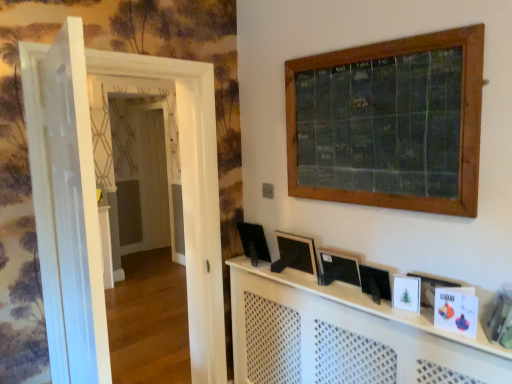
This screenshot has height=384, width=512. What do you see at coordinates (375, 280) in the screenshot? I see `black matte picture frame at center, the second picture frame positioned from the front` at bounding box center [375, 280].

What do you see at coordinates (295, 253) in the screenshot?
I see `black matte picture frame at center, acting as the first picture frame starting from the back` at bounding box center [295, 253].

Find the location of `white glossy door at left, which is counted as the 1th door, starting from the back`. white glossy door at left, which is counted as the 1th door, starting from the back is located at coordinates (96, 205).

The height and width of the screenshot is (384, 512). What do you see at coordinates (406, 293) in the screenshot?
I see `white matte picture frame at lower right, the 3th picture frame viewed from the back` at bounding box center [406, 293].

What do you see at coordinates (389, 123) in the screenshot?
I see `green slate window at upper center` at bounding box center [389, 123].

Where is `black plastic computer screen at center`? The height and width of the screenshot is (384, 512). black plastic computer screen at center is located at coordinates (254, 239).

Find the location of a particular element. Image resolution: width=512 pixels, height=384 pixels. white perforated wood at center is located at coordinates coord(344,336).

Does green slate window at upper center come in front of white perforated wood at center?

No, it is behind white perforated wood at center.

Which of these two, green slate window at upper center or white perforated wood at center, is smaller?

green slate window at upper center.

Is green slate window at upper center facing towards white perforated wood at center?

No.

In the scene shown: Can you confirm if black matte picture frame at center, the second picture frame in the back-to-front sequence, is positioned to the left of white glossy door at left, the second door when ordered from back to front?

No.

From the image's perspective, does black matte picture frame at center, the second picture frame in the back-to-front sequence, appear higher than white glossy door at left, the second door when ordered from back to front?

Incorrect, from the image's perspective, black matte picture frame at center, the second picture frame in the back-to-front sequence, is lower than white glossy door at left, the second door when ordered from back to front.

Is point (361, 283) in front of point (38, 71)?

No, (361, 283) is further to viewer.

Could you tell me if black matte picture frame at center, the second picture frame positioned from the front, is turned towards white glossy door at left, placed as the first door when sorted from front to back?

No, black matte picture frame at center, the second picture frame positioned from the front, does not turn towards white glossy door at left, placed as the first door when sorted from front to back.

In terms of height, does black plastic computer screen at center look taller or shorter compared to white glossy door at left, the second door when ordered from back to front?

In the image, black plastic computer screen at center appears to be shorter than white glossy door at left, the second door when ordered from back to front.

Is the position of black plastic computer screen at center less distant than that of white glossy door at left, placed as the first door when sorted from front to back?

That is False.

From a real-world perspective, is black plastic computer screen at center positioned above or below white glossy door at left, the second door when ordered from back to front?

From a real-world perspective, black plastic computer screen at center is physically below white glossy door at left, the second door when ordered from back to front.

Does black plastic computer screen at center turn towards white glossy door at left, the second door when ordered from back to front?

Yes.

In terms of size, does black matte picture frame at center, acting as the first picture frame starting from the back, appear bigger or smaller than white glossy door at left, the second door when ordered from back to front?

Considering their sizes, black matte picture frame at center, acting as the first picture frame starting from the back, takes up less space than white glossy door at left, the second door when ordered from back to front.

Could you tell me if black matte picture frame at center, marked as the third picture frame in a front-to-back arrangement, is facing white glossy door at left, placed as the first door when sorted from front to back?

Yes, black matte picture frame at center, marked as the third picture frame in a front-to-back arrangement, is oriented towards white glossy door at left, placed as the first door when sorted from front to back.

From the image's perspective, between black matte picture frame at center, marked as the 3th picture frame in a right-to-left arrangement, and white glossy door at left, placed as the first door when sorted from front to back, which one is located above?

From the image's view, white glossy door at left, placed as the first door when sorted from front to back, is above.

Is the surface of black matte picture frame at center, acting as the first picture frame starting from the back, in direct contact with white glossy door at left, placed as the first door when sorted from front to back?

No, black matte picture frame at center, acting as the first picture frame starting from the back, is not with white glossy door at left, placed as the first door when sorted from front to back.

Does point (417, 288) come in front of point (380, 280)?

Yes, point (417, 288) is closer to viewer.

Which object is closer to the camera, white matte picture frame at lower right, which ranks as the 1th picture frame in right-to-left order, or black matte picture frame at center, which is the second picture frame from right to left?

white matte picture frame at lower right, which ranks as the 1th picture frame in right-to-left order, is more forward.

From the image's perspective, which one is positioned lower, white matte picture frame at lower right, the 3th picture frame viewed from the back, or black matte picture frame at center, the second picture frame from the left?

white matte picture frame at lower right, the 3th picture frame viewed from the back, from the image's perspective.

Between white glossy door at left, the second door when ordered from back to front, and white matte picture frame at lower right, which ranks as the 1th picture frame in right-to-left order, which one appears on the right side from the viewer's perspective?

From the viewer's perspective, white matte picture frame at lower right, which ranks as the 1th picture frame in right-to-left order, appears more on the right side.

Considering the relative positions of white glossy door at left, placed as the first door when sorted from front to back, and white matte picture frame at lower right, placed as the 1th picture frame when sorted from front to back, in the image provided, is white glossy door at left, placed as the first door when sorted from front to back, in front of white matte picture frame at lower right, placed as the 1th picture frame when sorted from front to back,?

Yes, it is.

Considering the relative sizes of white glossy door at left, placed as the first door when sorted from front to back, and white matte picture frame at lower right, which ranks as the 1th picture frame in right-to-left order, in the image provided, is white glossy door at left, placed as the first door when sorted from front to back, taller than white matte picture frame at lower right, which ranks as the 1th picture frame in right-to-left order,?

Yes.

Does white glossy door at left, the second door when ordered from back to front, touch white matte picture frame at lower right, the 3th picture frame viewed from the back?

white glossy door at left, the second door when ordered from back to front, and white matte picture frame at lower right, the 3th picture frame viewed from the back, are clearly separated.

Is point (202, 285) farther from camera compared to point (281, 333)?

Yes.

Where is `computer desk located below the white glossy door at left, positioned as the 2th door in front-to-back order (from the image's perspective)`? Image resolution: width=512 pixels, height=384 pixels. computer desk located below the white glossy door at left, positioned as the 2th door in front-to-back order (from the image's perspective) is located at coordinates (344, 336).

From the image's perspective, relative to white perforated wood at center, is white glossy door at left, which is counted as the 1th door, starting from the back, above or below?

Based on their image positions, white glossy door at left, which is counted as the 1th door, starting from the back, is located above white perforated wood at center.

Considering their positions, is white glossy door at left, positioned as the 2th door in front-to-back order, located in front of or behind white perforated wood at center?

Visually, white glossy door at left, positioned as the 2th door in front-to-back order, is located behind white perforated wood at center.

Locate an element on the screen. computer desk in front of the green slate window at upper center is located at coordinates (344, 336).

I want to click on door that is the 2nd object to the left of the black matte picture frame at center, the second picture frame from the left, starting at the anchor, so click(66, 206).

Estimate the real-world distances between objects in this image. Which object is further from white perforated wood at center, white glossy door at left, placed as the first door when sorted from front to back, or white glossy door at left, positioned as the 2th door in front-to-back order?

The object further to white perforated wood at center is white glossy door at left, placed as the first door when sorted from front to back.

Looking at the image, which one is located further to white glossy door at left, positioned as the 2th door in front-to-back order, black plastic computer screen at center or white perforated wood at center?

white perforated wood at center is further to white glossy door at left, positioned as the 2th door in front-to-back order.

From the image, which object appears to be farther from white glossy door at left, placed as the first door when sorted from front to back, black matte picture frame at center, the second picture frame from the left, or green slate window at upper center?

black matte picture frame at center, the second picture frame from the left, is positioned further to the anchor white glossy door at left, placed as the first door when sorted from front to back.

From the image, which object appears to be farther from white glossy door at left, which is counted as the 1th door, starting from the back, white matte picture frame at lower right, the 3th picture frame viewed from the back, or green slate window at upper center?

The object further to white glossy door at left, which is counted as the 1th door, starting from the back, is white matte picture frame at lower right, the 3th picture frame viewed from the back.

Looking at the image, which one is located further to white glossy door at left, placed as the first door when sorted from front to back, white glossy door at left, positioned as the 2th door in front-to-back order, or green slate window at upper center?

Among the two, green slate window at upper center is located further to white glossy door at left, placed as the first door when sorted from front to back.

Based on their spatial positions, is white perforated wood at center or green slate window at upper center closer to black matte picture frame at center, marked as the 3th picture frame in a right-to-left arrangement?

The object closer to black matte picture frame at center, marked as the 3th picture frame in a right-to-left arrangement, is white perforated wood at center.

Estimate the real-world distances between objects in this image. Which object is closer to white glossy door at left, the second door when ordered from back to front, green slate window at upper center or white matte picture frame at lower right, the 3th picture frame in the left-to-right sequence?

green slate window at upper center is closer to white glossy door at left, the second door when ordered from back to front.

Estimate the real-world distances between objects in this image. Which object is further from white matte picture frame at lower right, placed as the 1th picture frame when sorted from front to back, black plastic computer screen at center or white glossy door at left, which is counted as the 1th door, starting from the back?

Based on the image, white glossy door at left, which is counted as the 1th door, starting from the back, appears to be further to white matte picture frame at lower right, placed as the 1th picture frame when sorted from front to back.

Find the location of a particular element. This screenshot has height=384, width=512. window situated between white glossy door at left, which is counted as the 1th door, starting from the back, and white matte picture frame at lower right, the 3th picture frame in the left-to-right sequence, from left to right is located at coordinates (389, 123).

Locate an element on the screen. computer screen located between white glossy door at left, positioned as the 2th door in front-to-back order, and green slate window at upper center in the left-right direction is located at coordinates (254, 239).

Find the location of a particular element. This screenshot has height=384, width=512. picture frame located between white glossy door at left, which is counted as the 1th door, starting from the back, and white perforated wood at center in the left-right direction is located at coordinates pos(295,253).

Find the location of a particular element. This screenshot has height=384, width=512. picture frame between green slate window at upper center and black matte picture frame at center, the second picture frame in the back-to-front sequence, in the up-down direction is located at coordinates (295, 253).